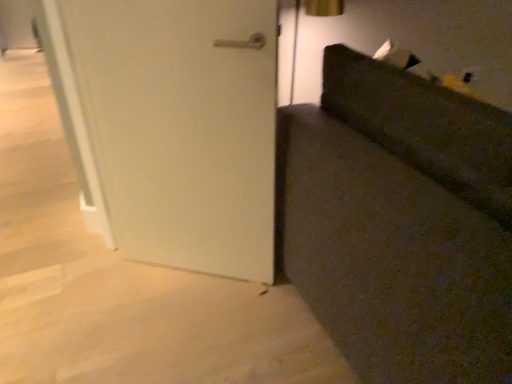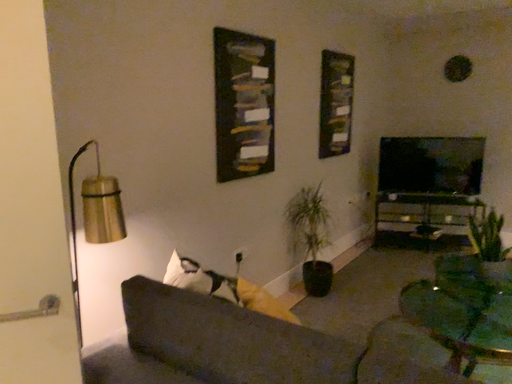
Question: Which way did the camera rotate in the video?

Choices:
 (A) rotated left
 (B) rotated right

Answer: (B)